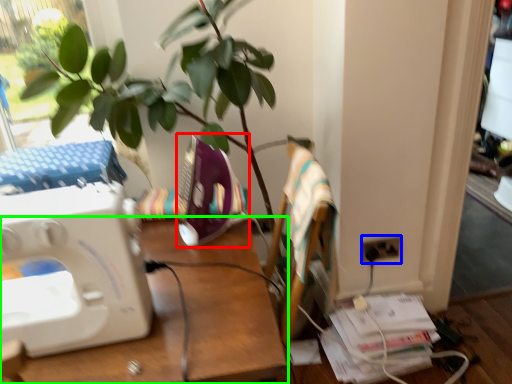
Question: Which is farther away from sewing machine (highlighted by a red box)? electric outlet (highlighted by a blue box) or desk (highlighted by a green box)?

Choices:
 (A) electric outlet
 (B) desk

Answer: (A)